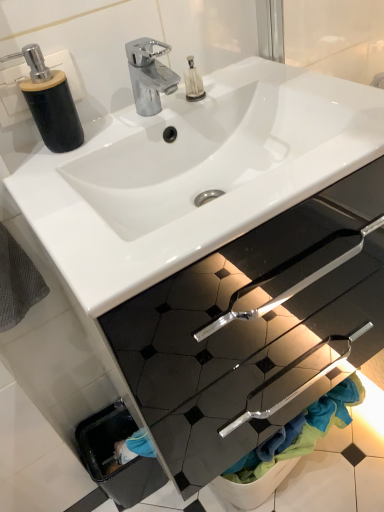
At what (x,y) coordinates should I click in order to perform the action: click on free location in front of matte black soap dispenser at upper left. Please return your answer as a coordinate pair (x, y). The image size is (384, 512). Looking at the image, I should click on (53, 184).